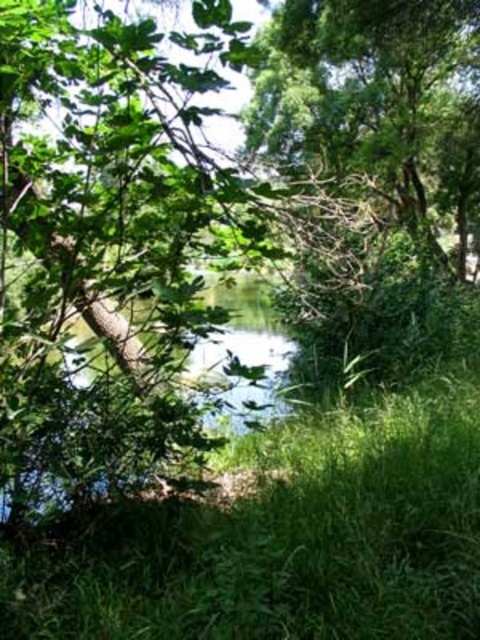
Question: Which point is closer to the camera?

Choices:
 (A) green leafy grass at center
 (B) green leafy tree at upper center

Answer: (A)

Question: Is green leafy grass at center positioned at the back of green leafy tree at upper center?

Choices:
 (A) yes
 (B) no

Answer: (B)

Question: Which point is closer to the camera?

Choices:
 (A) green leafy tree at upper center
 (B) green leafy grass at center

Answer: (B)

Question: Is green leafy grass at center closer to the viewer compared to green leafy tree at upper center?

Choices:
 (A) yes
 (B) no

Answer: (A)

Question: Is green leafy grass at center below green leafy tree at upper center?

Choices:
 (A) no
 (B) yes

Answer: (B)